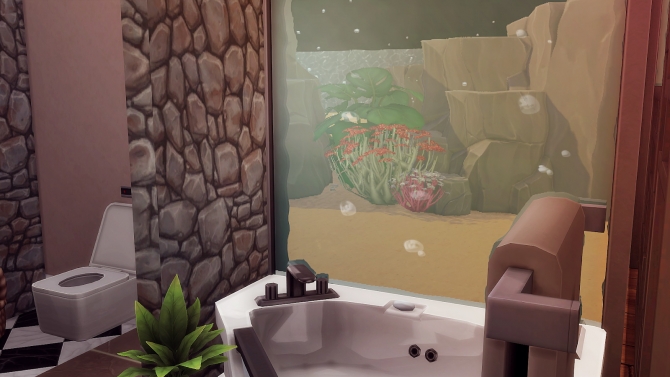
This screenshot has height=377, width=670. Identify the location of white bathtub. (350, 349).